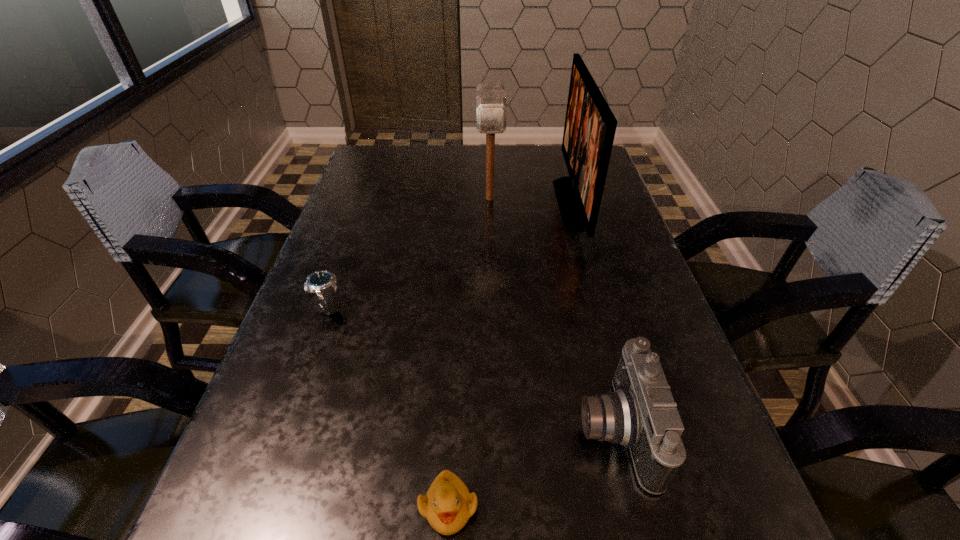
Image resolution: width=960 pixels, height=540 pixels. In order to click on vacant position at the left edge of the desktop in this screenshot , I will do `click(373, 236)`.

The width and height of the screenshot is (960, 540). In the image, there is a desktop. In order to click on vacant space at the right edge in this screenshot , I will do `click(646, 297)`.

In the image, there is a desktop. Where is `free region at the far left corner`? Image resolution: width=960 pixels, height=540 pixels. free region at the far left corner is located at coordinates (387, 148).

Find the location of `unoccupied area between the mallet and the third nearest object`. unoccupied area between the mallet and the third nearest object is located at coordinates (409, 253).

Locate an element on the screen. free point between the shortest object and the monitor is located at coordinates (511, 355).

Locate an element on the screen. free space between the mallet and the third tallest object is located at coordinates pyautogui.click(x=552, y=314).

Where is `vacant area that lies between the mallet and the monitor`? The height and width of the screenshot is (540, 960). vacant area that lies between the mallet and the monitor is located at coordinates (531, 201).

Find the location of a particular element. Image resolution: width=960 pixels, height=540 pixels. free space between the monitor and the leftmost object is located at coordinates (451, 255).

Identify the location of vacant area that lies between the third shortest object and the mallet. Image resolution: width=960 pixels, height=540 pixels. (552, 314).

Locate an element on the screen. This screenshot has width=960, height=540. free space between the fourth tallest object and the mallet is located at coordinates (409, 253).